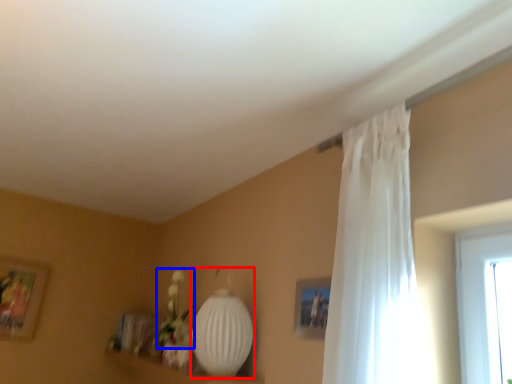
Question: Among these objects, which one is farthest to the camera, lamp (highlighted by a red box) or floral arrangement (highlighted by a blue box)?

Choices:
 (A) lamp
 (B) floral arrangement

Answer: (B)